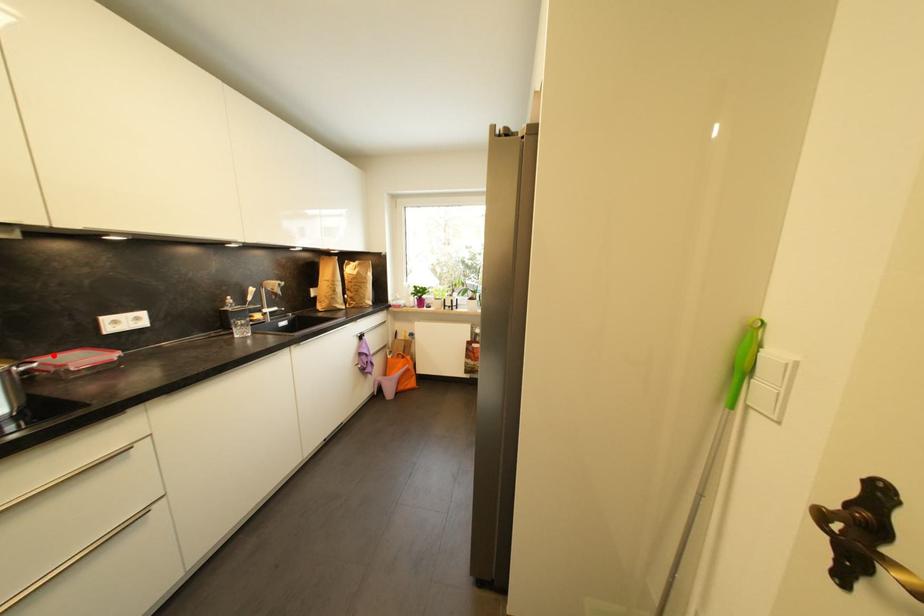
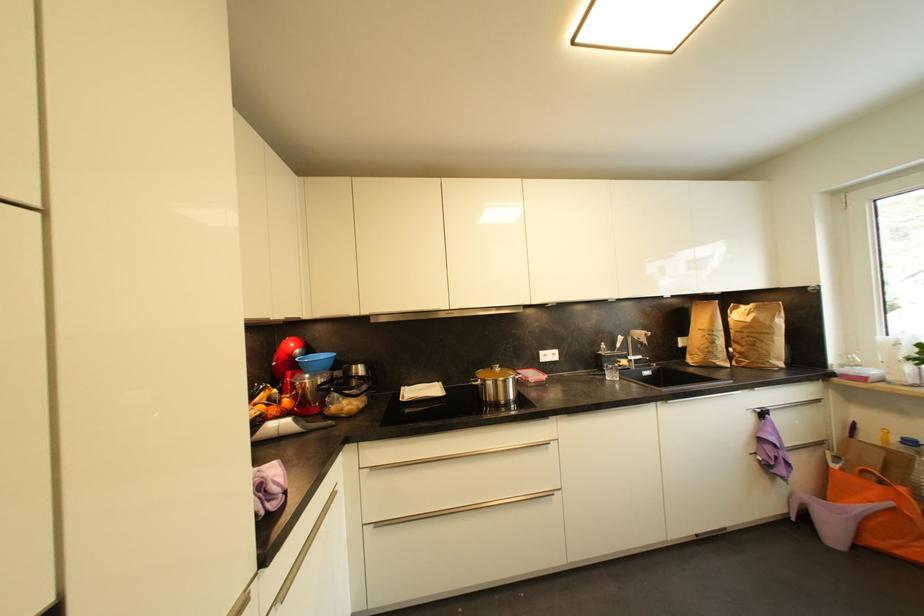
Where in the second image is the point corresponding to the highlighted location from the first image?

(528, 371)